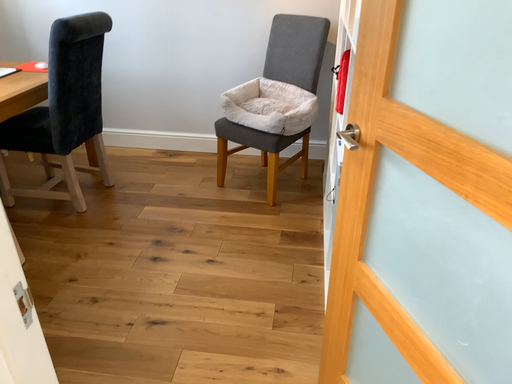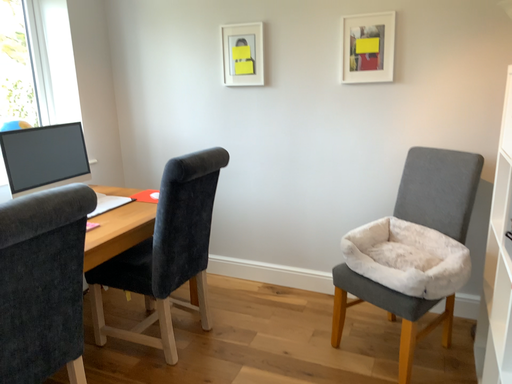
Question: How did the camera likely rotate when shooting the video?

Choices:
 (A) rotated upward
 (B) rotated downward

Answer: (A)